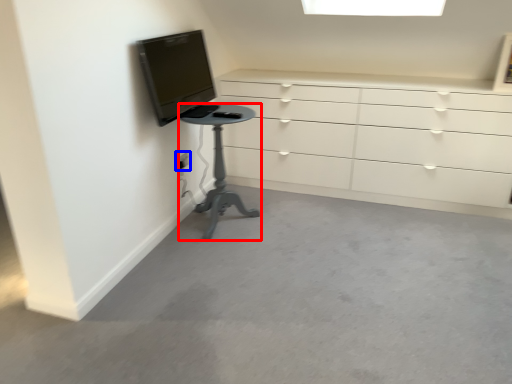
Question: Which object appears farthest to the camera in this image, furniture (highlighted by a red box) or electric outlet (highlighted by a blue box)?

Choices:
 (A) furniture
 (B) electric outlet

Answer: (B)